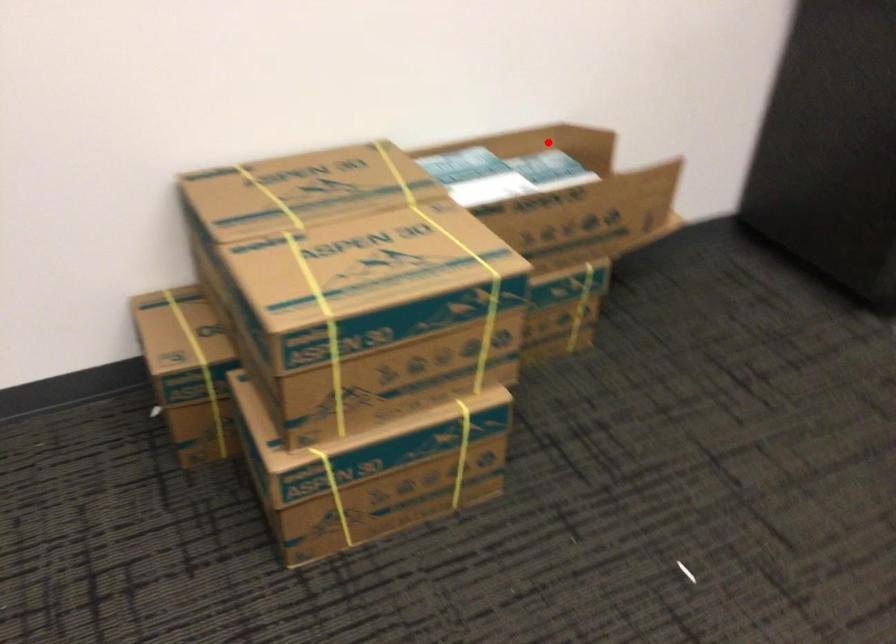
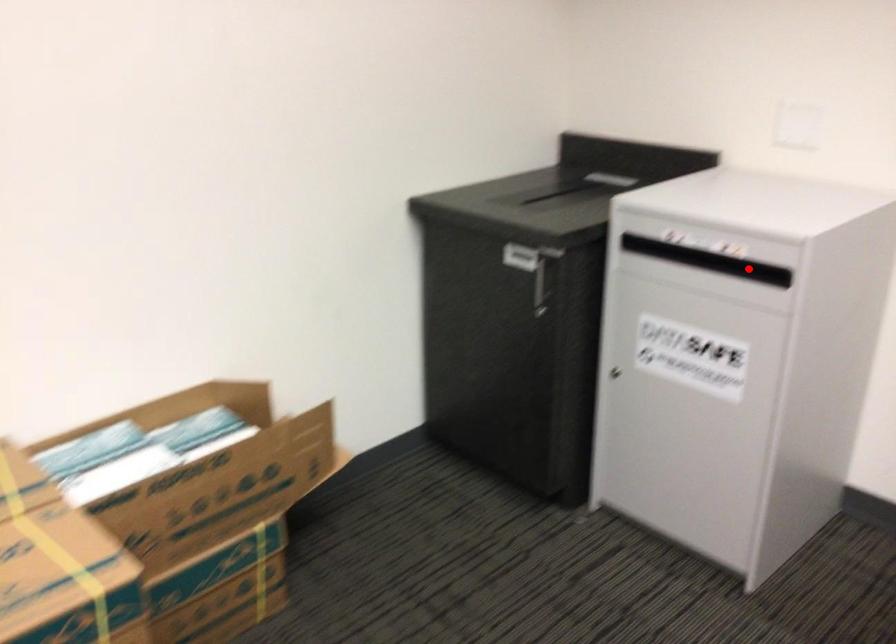
I am providing you with two images of the same scene from different viewpoints. A red point is marked on the first image and another point is marked on the second image. Is the red point in image1 aligned with the point shown in image2?

No